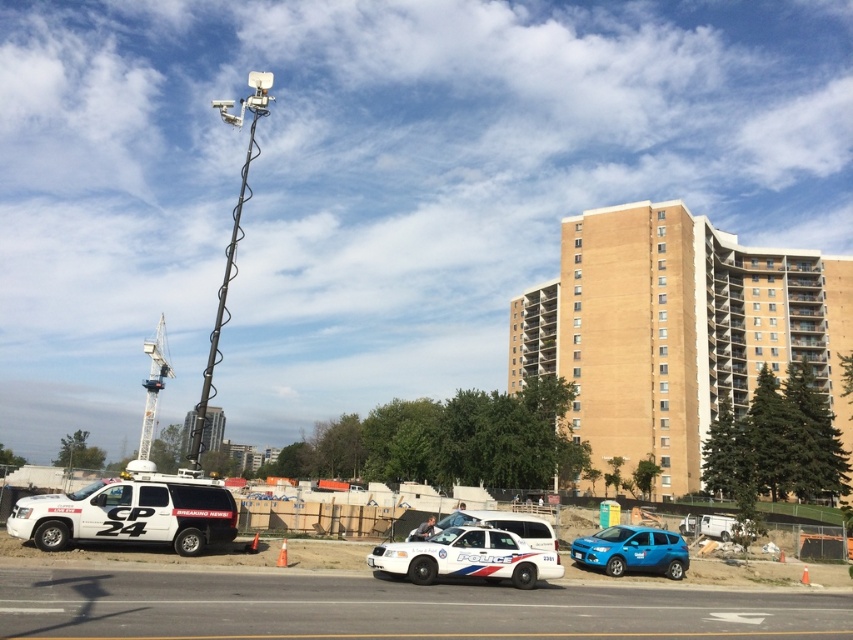
Measure the distance between white matte van at center and white glossy police car at center.

white matte van at center is 7.54 meters away from white glossy police car at center.

Does white matte van at center have a greater width compared to white glossy police car at center?

Indeed, white matte van at center has a greater width compared to white glossy police car at center.

Is point (143, 500) behind point (490, 540)?

No, (143, 500) is closer to viewer.

Find the location of a particular element. white matte van at center is located at coordinates (131, 512).

Is white glossy police car at center smaller than white metallic crane at upper left?

Correct, white glossy police car at center occupies less space than white metallic crane at upper left.

Where is `white glossy police car at center`? The height and width of the screenshot is (640, 853). white glossy police car at center is located at coordinates (467, 557).

Does white matte van at center have a lesser height compared to white metallic crane at upper left?

Indeed, white matte van at center has a lesser height compared to white metallic crane at upper left.

Does white matte van at center have a greater height compared to white metallic crane at upper left?

Incorrect, white matte van at center's height is not larger of white metallic crane at upper left's.

What do you see at coordinates (131, 512) in the screenshot? I see `white matte van at center` at bounding box center [131, 512].

At what (x,y) coordinates should I click in order to perform the action: click on white matte van at center. Please return your answer as a coordinate pair (x, y). The image size is (853, 640). Looking at the image, I should click on (131, 512).